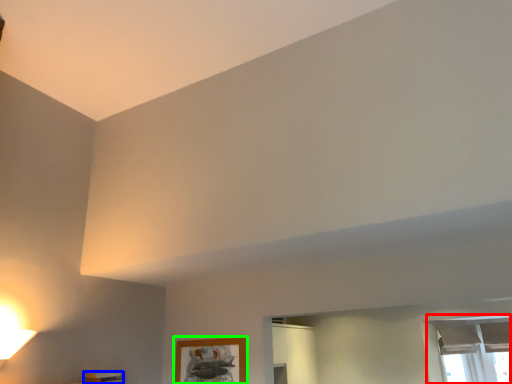
Question: Estimate the real-world distances between objects in this image. Which object is farther from window (highlighted by a red box), furniture (highlighted by a blue box) or picture frame (highlighted by a green box)?

Choices:
 (A) furniture
 (B) picture frame

Answer: (A)